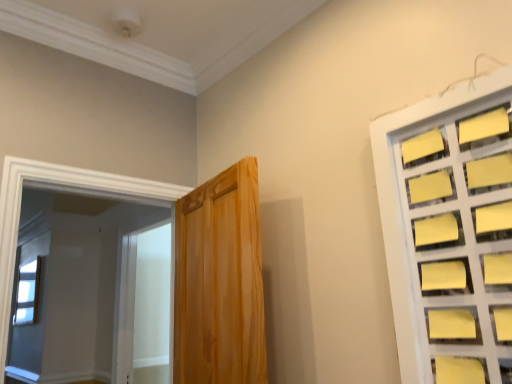
Where is `white frosted glass screen door at left`? The image size is (512, 384). white frosted glass screen door at left is located at coordinates (144, 306).

You are a GUI agent. You are given a task and a screenshot of the screen. Output one action in this format:
    pyautogui.click(x=<x>, y=<y>)
    Task: Click on the yellow paper at right, arranged as the 1th window when viewed from the top
    The image size is (512, 384).
    Given the screenshot: What is the action you would take?
    pyautogui.click(x=450, y=230)

Considering the relative sizes of wooden door at center and white frosted glass screen door at left in the image provided, is wooden door at center bigger than white frosted glass screen door at left?

Indeed, wooden door at center has a larger size compared to white frosted glass screen door at left.

Is point (202, 284) closer or farther from the camera than point (136, 370)?

Point (202, 284).

From a real-world perspective, is wooden door at center above or below white frosted glass screen door at left?

wooden door at center is situated higher than white frosted glass screen door at left in the real world.

In the image, there is a yellow paper at right, arranged as the 1th window when viewed from the top. Where is `door below it (from a real-world perspective)`? door below it (from a real-world perspective) is located at coordinates (219, 281).

From the image's perspective, is wooden door at center located beneath yellow paper at right, the 2th window in the bottom-to-top sequence?

Indeed, from the image's perspective, wooden door at center is shown beneath yellow paper at right, the 2th window in the bottom-to-top sequence.

Considering the relative sizes of wooden door at center and yellow paper at right, which is the second window from back to front, in the image provided, is wooden door at center shorter than yellow paper at right, which is the second window from back to front,?

Incorrect, the height of wooden door at center does not fall short of that of yellow paper at right, which is the second window from back to front.

Which object is further away from the camera taking this photo, wooden door at center or yellow paper at right, which is the second window from back to front?

wooden door at center.

Considering the sizes of clear glass window at upper left, the first window when ordered from left to right, and white frosted glass screen door at left in the image, is clear glass window at upper left, the first window when ordered from left to right, bigger or smaller than white frosted glass screen door at left?

Considering their sizes, clear glass window at upper left, the first window when ordered from left to right, takes up less space than white frosted glass screen door at left.

Between clear glass window at upper left, which is counted as the second window, starting from the right, and white frosted glass screen door at left, which one has more height?

white frosted glass screen door at left.

Considering the positions of objects clear glass window at upper left, which appears as the 1th window when ordered from the bottom, and white frosted glass screen door at left in the image provided, who is in front, clear glass window at upper left, which appears as the 1th window when ordered from the bottom, or white frosted glass screen door at left?

white frosted glass screen door at left.

The width and height of the screenshot is (512, 384). In order to click on screen door on the right side of clear glass window at upper left, the 2th window when ordered from top to bottom in this screenshot , I will do `click(144, 306)`.

Considering the sizes of objects clear glass window at upper left, the first window when ordered from left to right, and yellow paper at right, the 2th window in the bottom-to-top sequence, in the image provided, who is shorter, clear glass window at upper left, the first window when ordered from left to right, or yellow paper at right, the 2th window in the bottom-to-top sequence,?

Standing shorter between the two is clear glass window at upper left, the first window when ordered from left to right.

In the scene shown: Which is closer to the camera, (26, 299) or (480, 117)?

Point (26, 299) is positioned farther from the camera compared to point (480, 117).

Would you say yellow paper at right, arranged as the 1th window when viewed from the top, is part of clear glass window at upper left, which is counted as the second window, starting from the right,'s contents?

No, yellow paper at right, arranged as the 1th window when viewed from the top, is not surrounded by clear glass window at upper left, which is counted as the second window, starting from the right.

From a real-world perspective, is clear glass window at upper left, which is counted as the 1th window, starting from the back, positioned under yellow paper at right, which is the second window from back to front, based on gravity?

Actually, clear glass window at upper left, which is counted as the 1th window, starting from the back, is physically above yellow paper at right, which is the second window from back to front, in the real world.

Can you confirm if yellow paper at right, the first window from the right, is positioned to the left of clear glass window at upper left, which is counted as the 1th window, starting from the back?

Incorrect, yellow paper at right, the first window from the right, is not on the left side of clear glass window at upper left, which is counted as the 1th window, starting from the back.

Find the location of `window located underneath the clear glass window at upper left, which appears as the 1th window when ordered from the bottom (from a real-world perspective)`. window located underneath the clear glass window at upper left, which appears as the 1th window when ordered from the bottom (from a real-world perspective) is located at coordinates (450, 230).

From a real-world perspective, which object rests below the other?

From a 3D spatial view, yellow paper at right, which is the second window from back to front, is below.

Considering the sizes of yellow paper at right, the 2th window in the bottom-to-top sequence, and clear glass window at upper left, the 2th window when ordered from top to bottom, in the image, is yellow paper at right, the 2th window in the bottom-to-top sequence, taller or shorter than clear glass window at upper left, the 2th window when ordered from top to bottom,?

In the image, yellow paper at right, the 2th window in the bottom-to-top sequence, appears to be taller than clear glass window at upper left, the 2th window when ordered from top to bottom.

From the image's perspective, does white frosted glass screen door at left appear lower than wooden door at center?

Indeed, from the image's perspective, white frosted glass screen door at left is shown beneath wooden door at center.

Is white frosted glass screen door at left positioned with its back to wooden door at center?

No, white frosted glass screen door at left is not facing the opposite direction of wooden door at center.

Is white frosted glass screen door at left positioned beyond the bounds of wooden door at center?

Yes, white frosted glass screen door at left is outside of wooden door at center.

In the scene shown: Which object is closer to the camera taking this photo, white frosted glass screen door at left or wooden door at center?

wooden door at center is closer to the camera.

Is white frosted glass screen door at left aimed at clear glass window at upper left, which appears as the 1th window when ordered from the bottom?

No, white frosted glass screen door at left does not turn towards clear glass window at upper left, which appears as the 1th window when ordered from the bottom.

How far apart are white frosted glass screen door at left and clear glass window at upper left, the first window when ordered from left to right?

They are 33.74 inches apart.

From the image's perspective, relative to clear glass window at upper left, the first window when ordered from left to right, is white frosted glass screen door at left above or below?

white frosted glass screen door at left is situated higher than clear glass window at upper left, the first window when ordered from left to right, in the image.

Locate an element on the screen. The width and height of the screenshot is (512, 384). door positioned vertically above the white frosted glass screen door at left (from a real-world perspective) is located at coordinates (219, 281).

Locate an element on the screen. window on the right of wooden door at center is located at coordinates (450, 230).

Estimate the real-world distances between objects in this image. Which object is further from yellow paper at right, acting as the 2th window starting from the left, clear glass window at upper left, the first window when ordered from left to right, or wooden door at center?

clear glass window at upper left, the first window when ordered from left to right, is further to yellow paper at right, acting as the 2th window starting from the left.

Estimate the real-world distances between objects in this image. Which object is closer to clear glass window at upper left, which appears as the 1th window when ordered from the bottom, yellow paper at right, acting as the 2th window starting from the left, or white frosted glass screen door at left?

white frosted glass screen door at left is closer to clear glass window at upper left, which appears as the 1th window when ordered from the bottom.

From the image, which object appears to be nearer to yellow paper at right, arranged as the 1th window when viewed from the top, clear glass window at upper left, which is counted as the second window, starting from the right, or white frosted glass screen door at left?

Based on the image, white frosted glass screen door at left appears to be nearer to yellow paper at right, arranged as the 1th window when viewed from the top.

From the image, which object appears to be nearer to yellow paper at right, which is the second window from back to front, wooden door at center or clear glass window at upper left, the first window when ordered from left to right?

The object closer to yellow paper at right, which is the second window from back to front, is wooden door at center.

Based on their spatial positions, is clear glass window at upper left, which appears as the 1th window when ordered from the bottom, or white frosted glass screen door at left closer to wooden door at center?

Among the two, white frosted glass screen door at left is located nearer to wooden door at center.

Estimate the real-world distances between objects in this image. Which object is further from wooden door at center, clear glass window at upper left, which is counted as the second window, starting from the right, or yellow paper at right, acting as the 2th window starting from the left?

Among the two, clear glass window at upper left, which is counted as the second window, starting from the right, is located further to wooden door at center.

Estimate the real-world distances between objects in this image. Which object is further from wooden door at center, white frosted glass screen door at left or yellow paper at right, arranged as the 1th window when viewed from the top?

Based on the image, white frosted glass screen door at left appears to be further to wooden door at center.

Based on their spatial positions, is white frosted glass screen door at left or clear glass window at upper left, which is counted as the second window, starting from the right, further from wooden door at center?

clear glass window at upper left, which is counted as the second window, starting from the right.

Identify the location of screen door situated between clear glass window at upper left, which appears as the 1th window when ordered from the bottom, and yellow paper at right, the first window from the right, from left to right. (144, 306).

You are a GUI agent. You are given a task and a screenshot of the screen. Output one action in this format:
    pyautogui.click(x=<x>, y=<y>)
    Task: Click on the door situated between clear glass window at upper left, the 2th window when ordered from top to bottom, and yellow paper at right, which is the second window from back to front, from left to right
    Image resolution: width=512 pixels, height=384 pixels.
    Given the screenshot: What is the action you would take?
    pyautogui.click(x=219, y=281)

At what (x,y) coordinates should I click in order to perform the action: click on door positioned between yellow paper at right, the first window from the right, and white frosted glass screen door at left from near to far. Please return your answer as a coordinate pair (x, y). This screenshot has width=512, height=384. Looking at the image, I should click on (219, 281).

Identify the location of screen door positioned between wooden door at center and clear glass window at upper left, which ranks as the 2th window in front-to-back order, from near to far. (144, 306).